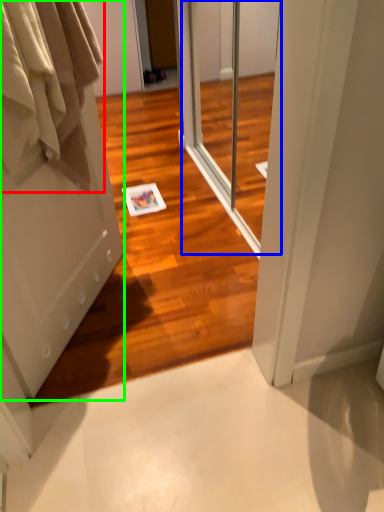
Question: Estimate the real-world distances between objects in this image. Which object is closer to clothing (highlighted by a red box), screen door (highlighted by a blue box) or door (highlighted by a green box)?

Choices:
 (A) screen door
 (B) door

Answer: (B)